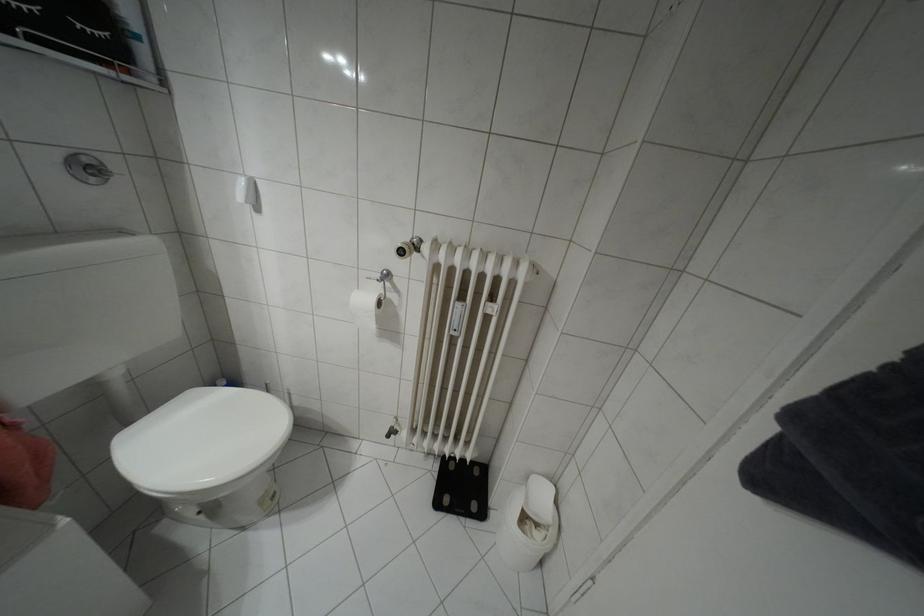
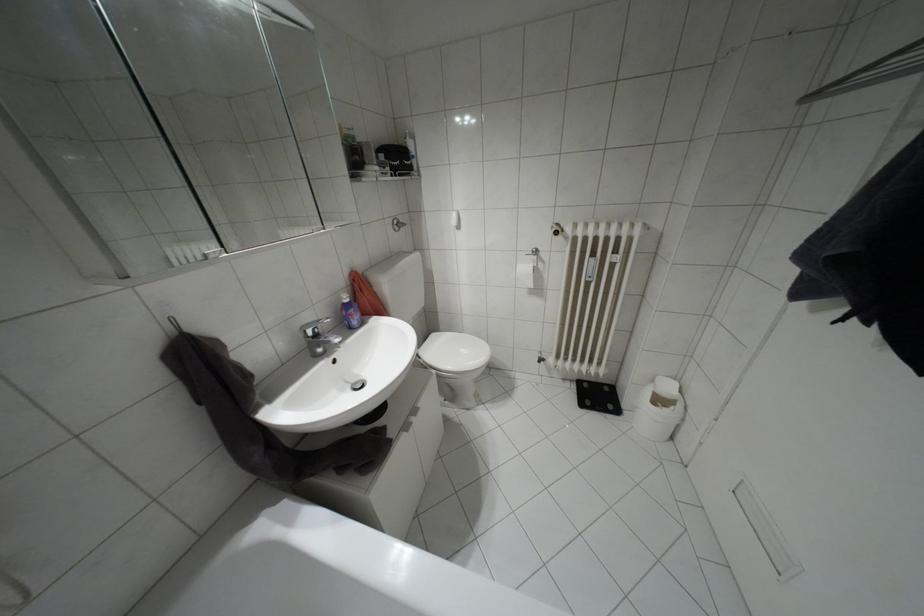
Find the pixel in the second image that matches point 436,504 in the first image.

(580, 405)